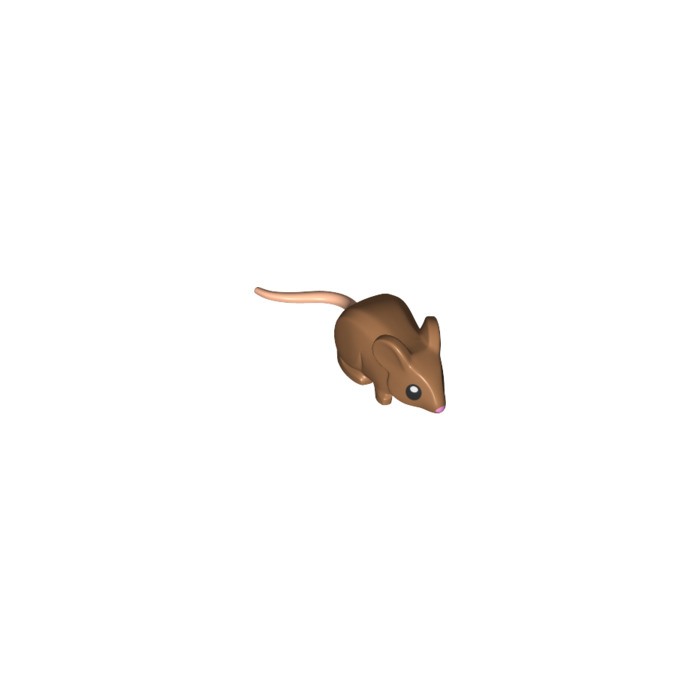
You are a GUI agent. You are given a task and a screenshot of the screen. Output one action in this format:
    pyautogui.click(x=<x>, y=<y>)
    Task: Click on the mouse
    
    Given the screenshot: What is the action you would take?
    pyautogui.click(x=395, y=356)